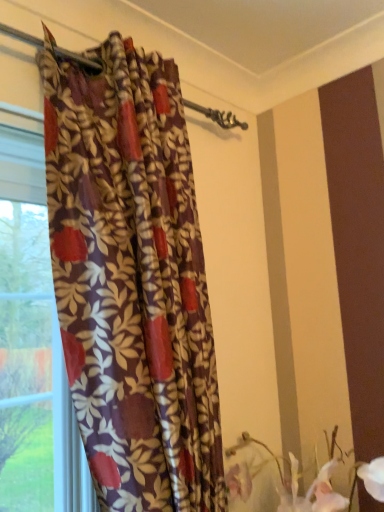
Question: Is floral-patterned fabric curtain at left shorter than fluffy fabric flowers at lower right?

Choices:
 (A) yes
 (B) no

Answer: (B)

Question: Is fluffy fabric flowers at lower right at the back of floral-patterned fabric curtain at left?

Choices:
 (A) yes
 (B) no

Answer: (B)

Question: From the image's perspective, is floral-patterned fabric curtain at left on top of fluffy fabric flowers at lower right?

Choices:
 (A) yes
 (B) no

Answer: (A)

Question: Considering the relative positions of floral-patterned fabric curtain at left and fluffy fabric flowers at lower right in the image provided, is floral-patterned fabric curtain at left to the right of fluffy fabric flowers at lower right from the viewer's perspective?

Choices:
 (A) no
 (B) yes

Answer: (A)

Question: From a real-world perspective, is floral-patterned fabric curtain at left on fluffy fabric flowers at lower right?

Choices:
 (A) yes
 (B) no

Answer: (A)

Question: From a real-world perspective, is floral-patterned fabric curtain at left physically below fluffy fabric flowers at lower right?

Choices:
 (A) yes
 (B) no

Answer: (B)

Question: Is fluffy fabric flowers at lower right thinner than floral-patterned fabric curtain at left?

Choices:
 (A) yes
 (B) no

Answer: (B)

Question: Considering the relative sizes of fluffy fabric flowers at lower right and floral-patterned fabric curtain at left in the image provided, is fluffy fabric flowers at lower right wider than floral-patterned fabric curtain at left?

Choices:
 (A) yes
 (B) no

Answer: (A)

Question: From a real-world perspective, is fluffy fabric flowers at lower right below floral-patterned fabric curtain at left?

Choices:
 (A) yes
 (B) no

Answer: (A)

Question: Considering the relative positions of fluffy fabric flowers at lower right and floral-patterned fabric curtain at left in the image provided, is fluffy fabric flowers at lower right to the left of floral-patterned fabric curtain at left from the viewer's perspective?

Choices:
 (A) no
 (B) yes

Answer: (A)

Question: Considering the relative positions of fluffy fabric flowers at lower right and floral-patterned fabric curtain at left in the image provided, is fluffy fabric flowers at lower right to the right of floral-patterned fabric curtain at left from the viewer's perspective?

Choices:
 (A) no
 (B) yes

Answer: (B)

Question: Can you confirm if fluffy fabric flowers at lower right is smaller than floral-patterned fabric curtain at left?

Choices:
 (A) no
 (B) yes

Answer: (B)

Question: In terms of size, does fluffy fabric flowers at lower right appear bigger or smaller than floral-patterned fabric curtain at left?

Choices:
 (A) big
 (B) small

Answer: (B)